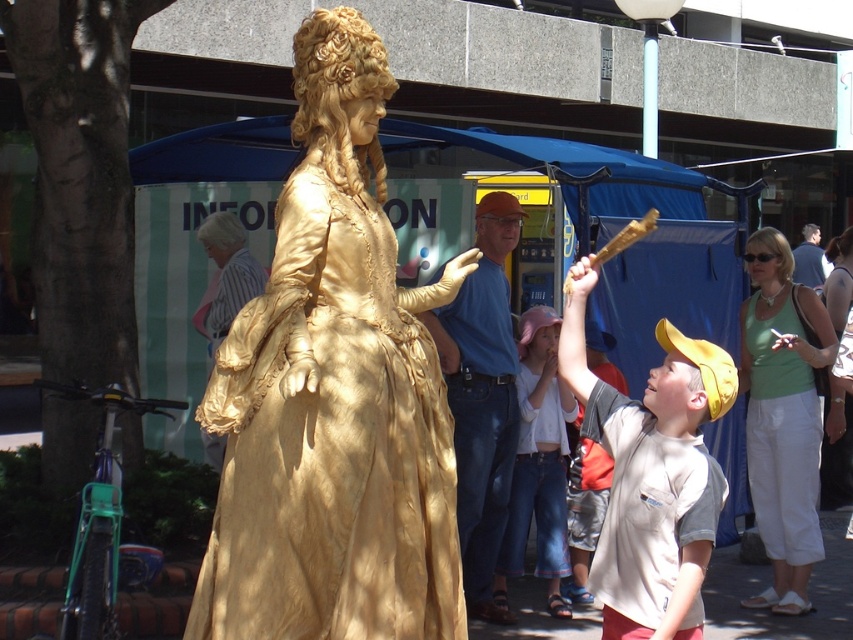
You are a tailor who needs to determine if the gold silk statue at center can fit into a display case designed for the light brown leather jacket at upper right. Based on their sizes, can the statue fit?

The gold silk statue at center might be wider than light brown leather jacket at upper right, so it may not fit into the display case designed for the jacket.